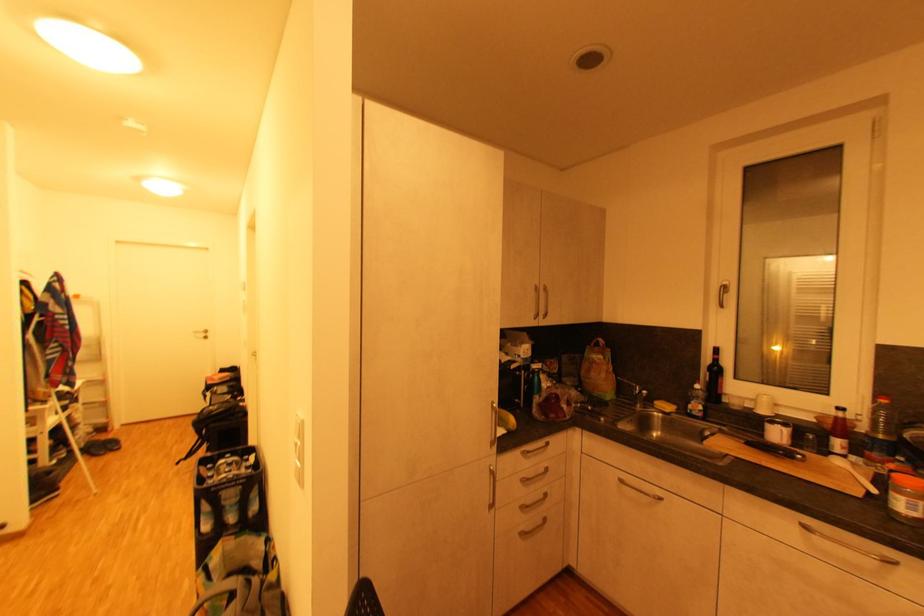
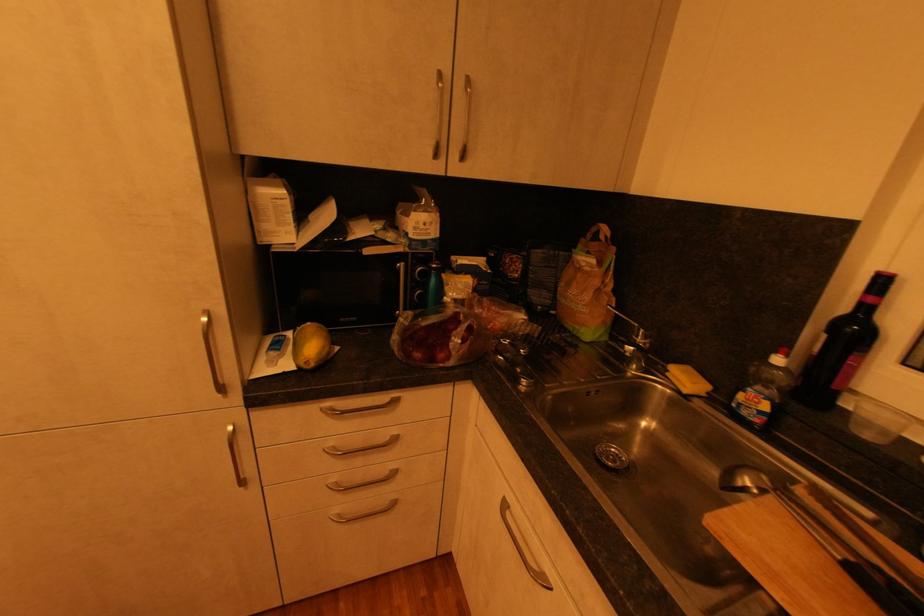
In the second image, find the point that corresponds to point (520, 428) in the first image.

(317, 365)